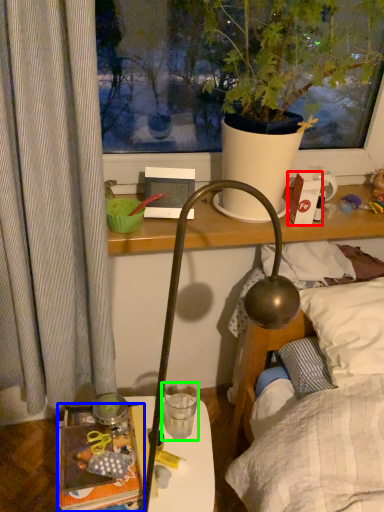
Question: Based on their relative distances, which object is farther from box (highlighted by a red box)? Choose from book (highlighted by a blue box) and coffee cup (highlighted by a green box).

Choices:
 (A) book
 (B) coffee cup

Answer: (A)